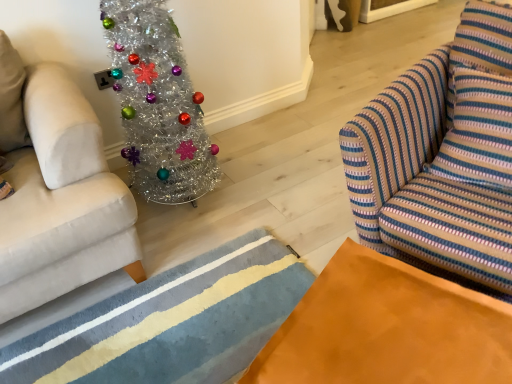
Question: From their relative heights in the image, would you say shiny silver christmas tree at left is taller or shorter than textured wool rug at lower center?

Choices:
 (A) short
 (B) tall

Answer: (B)

Question: Is shiny silver christmas tree at left inside or outside of textured wool rug at lower center?

Choices:
 (A) inside
 (B) outside

Answer: (B)

Question: Estimate the real-world distances between objects in this image. Which object is closer to the orange suede table at lower right?

Choices:
 (A) striped fabric swivel chair at right
 (B) textured wool rug at lower center
 (C) shiny silver christmas tree at left

Answer: (A)

Question: Based on their relative distances, which object is nearer to the shiny silver christmas tree at left?

Choices:
 (A) orange suede table at lower right
 (B) striped fabric swivel chair at right
 (C) textured wool rug at lower center

Answer: (C)